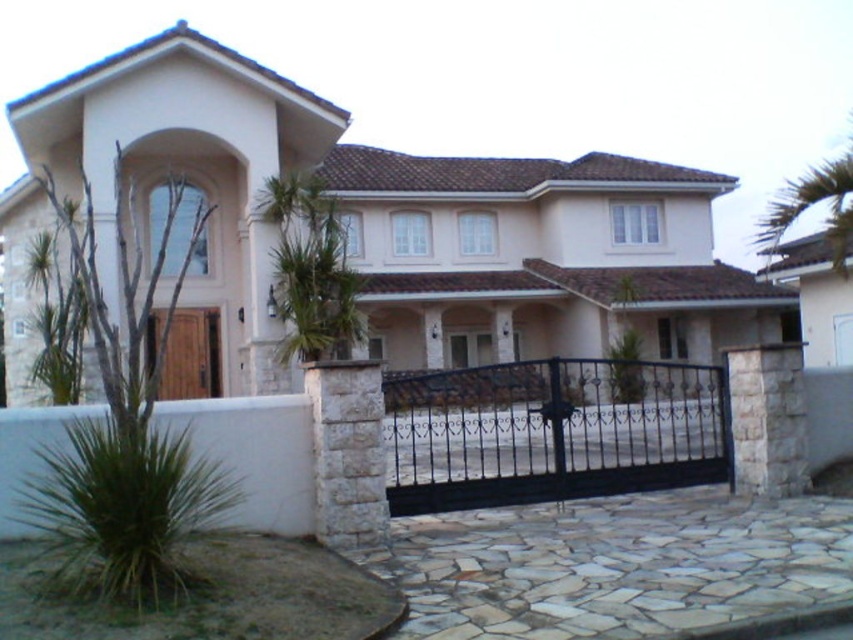
Question: In this image, where is natural stone driveway at center located relative to black wrought iron gate at center?

Choices:
 (A) below
 (B) above

Answer: (A)

Question: Among these objects, which one is farthest from the camera?

Choices:
 (A) black wrought iron gate at center
 (B) natural stone driveway at center
 (C) green leafy palm tree at center

Answer: (C)

Question: Which object appears farthest from the camera in this image?

Choices:
 (A) natural stone driveway at center
 (B) black wrought iron gate at center
 (C) green leafy palm tree at center

Answer: (C)

Question: Which of the following is the closest to the observer?

Choices:
 (A) natural stone driveway at center
 (B) green leafy palm tree at center

Answer: (A)

Question: Is natural stone driveway at center to the right of green leafy palm tree at center from the viewer's perspective?

Choices:
 (A) yes
 (B) no

Answer: (A)

Question: From the image, what is the correct spatial relationship of black wrought iron gate at center in relation to green leafy palm tree at center?

Choices:
 (A) right
 (B) left

Answer: (A)